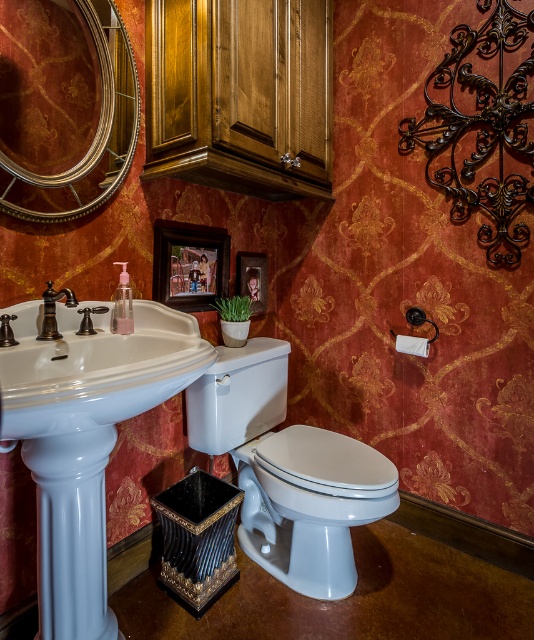
Is white glossy sink at lower left above polished brass faucet at left?

No.

Between white glossy sink at lower left and polished brass faucet at left, which one appears on the left side from the viewer's perspective?

Positioned to the left is polished brass faucet at left.

Image resolution: width=534 pixels, height=640 pixels. What do you see at coordinates (96, 369) in the screenshot?
I see `white glossy sink at lower left` at bounding box center [96, 369].

This screenshot has height=640, width=534. What are the coordinates of `white glossy sink at lower left` in the screenshot? It's located at (96, 369).

Measure the distance between white glossy toilet bowl at center and camera.

They are 1.31 meters apart.

In the scene shown: Which is more to the right, white glossy toilet bowl at center or polished brass faucet at left?

From the viewer's perspective, white glossy toilet bowl at center appears more on the right side.

Who is more forward, (294, 520) or (53, 298)?

Positioned in front is point (53, 298).

Image resolution: width=534 pixels, height=640 pixels. Find the location of `white glossy toilet bowl at center`. white glossy toilet bowl at center is located at coordinates (287, 472).

Does white glossy toilet bowl at center have a greater height compared to wooden picture frame at center?

Correct, white glossy toilet bowl at center is much taller as wooden picture frame at center.

Describe the element at coordinates (287, 472) in the screenshot. The height and width of the screenshot is (640, 534). I see `white glossy toilet bowl at center` at that location.

What are the coordinates of `white glossy toilet bowl at center` in the screenshot? It's located at (287, 472).